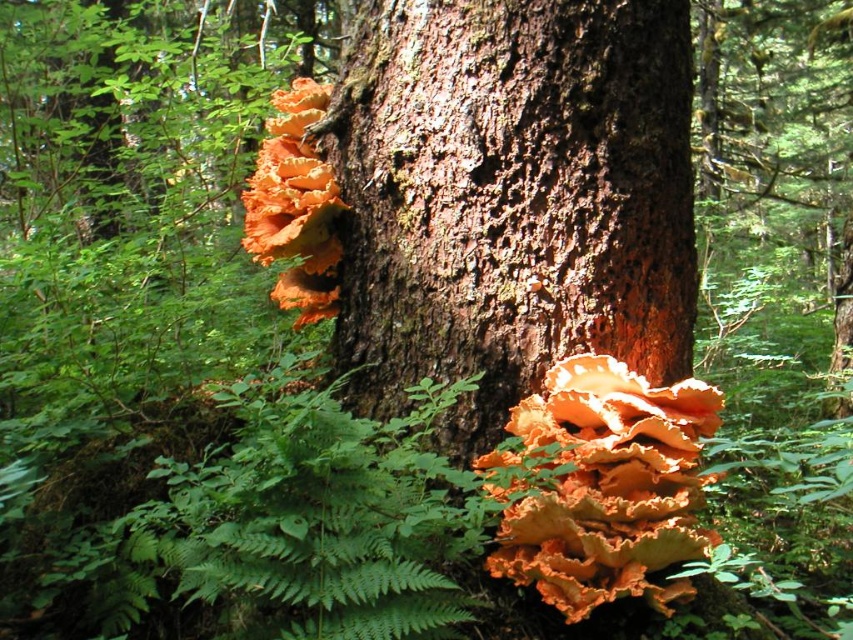
Can you confirm if green leafy fern at lower center is positioned to the left of orange papery fungi at upper center?

No, green leafy fern at lower center is not to the left of orange papery fungi at upper center.

Can you confirm if green leafy fern at lower center is taller than orange papery fungi at upper center?

In fact, green leafy fern at lower center may be shorter than orange papery fungi at upper center.

Is point (144, 529) farther from camera compared to point (337, 241)?

No.

Where is `green leafy fern at lower center`? green leafy fern at lower center is located at coordinates (321, 515).

Who is taller, rough bark tree trunk at center or green leafy fern at lower center?

Standing taller between the two is rough bark tree trunk at center.

Find the location of a particular element. This screenshot has width=853, height=640. rough bark tree trunk at center is located at coordinates (509, 198).

Does green leafy fern at lower center appear under orange papery fungus at center?

Incorrect, green leafy fern at lower center is not positioned below orange papery fungus at center.

Where is `green leafy fern at lower center`? The height and width of the screenshot is (640, 853). green leafy fern at lower center is located at coordinates (321, 515).

Does point (262, 515) lie behind point (599, 464)?

No, (262, 515) is in front of (599, 464).

Locate an element on the screen. The height and width of the screenshot is (640, 853). green leafy fern at lower center is located at coordinates (321, 515).